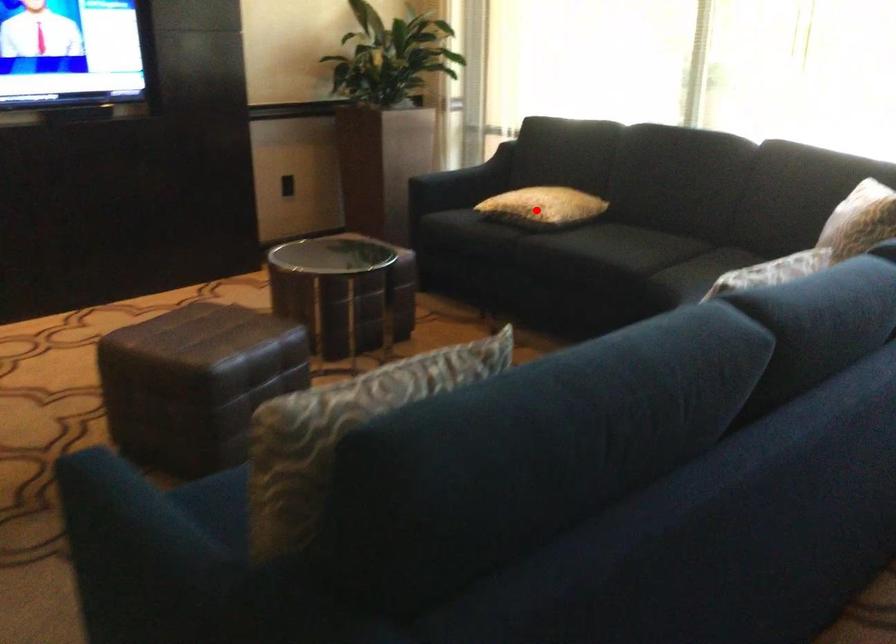
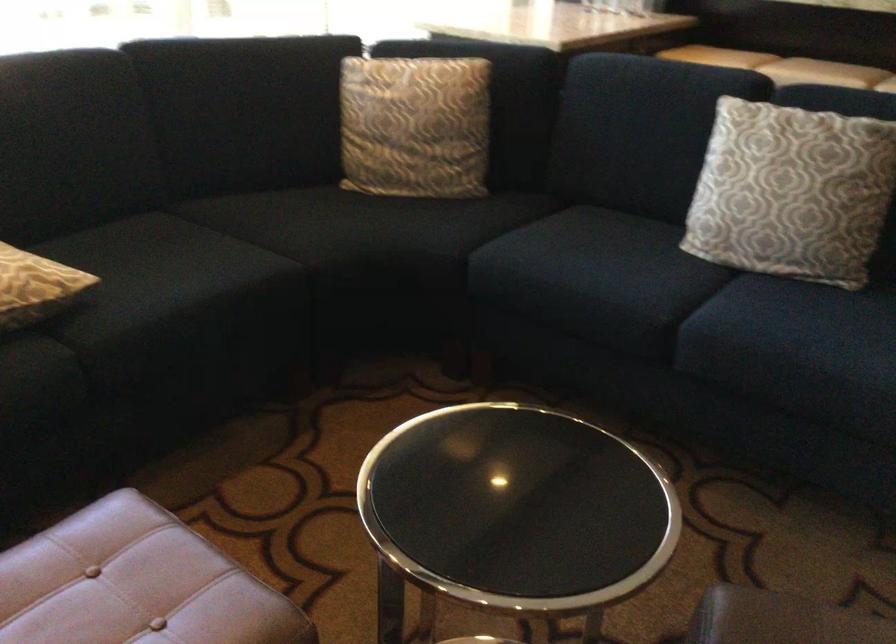
Find the pixel in the second image that matches the highlighted location in the first image.

(35, 287)